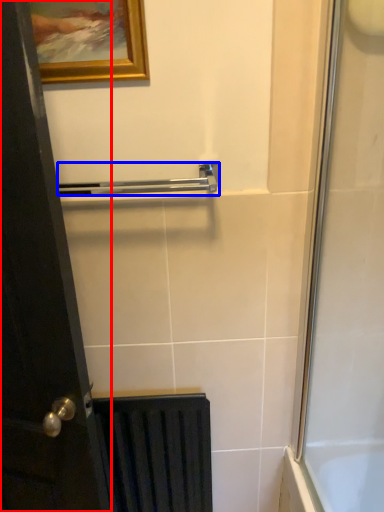
Question: Which object is further to the camera taking this photo, door (highlighted by a red box) or towel bar (highlighted by a blue box)?

Choices:
 (A) door
 (B) towel bar

Answer: (B)